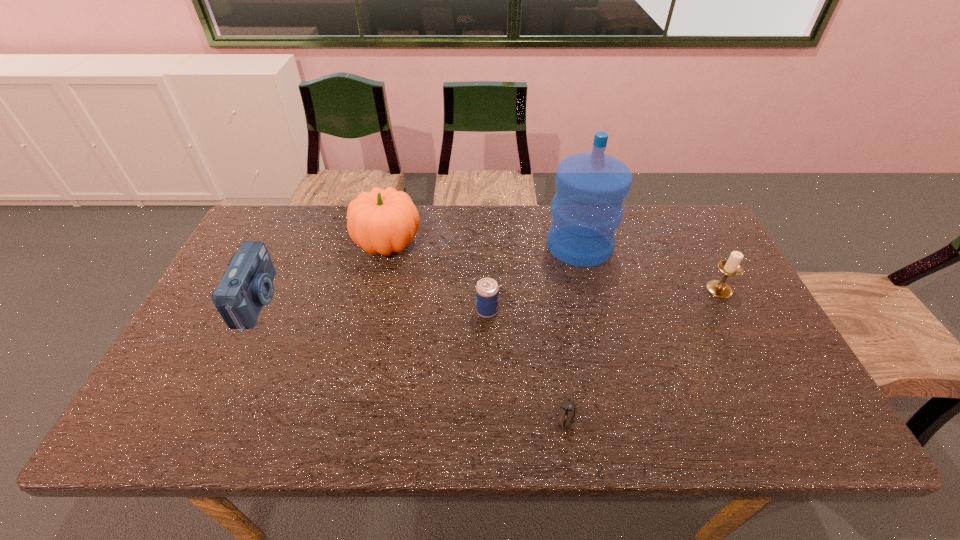
This screenshot has width=960, height=540. I want to click on free space at the far edge of the desktop, so click(x=654, y=231).

You are a GUI agent. You are given a task and a screenshot of the screen. Output one action in this format:
    pyautogui.click(x=<x>, y=<y>)
    Task: Click on the vacant space at the near edge of the desktop
    
    Given the screenshot: What is the action you would take?
    pyautogui.click(x=672, y=413)

In the image, there is a desktop. At what (x,y) coordinates should I click in order to perform the action: click on blank space at the left edge. Please return your answer as a coordinate pair (x, y). The height and width of the screenshot is (540, 960). Looking at the image, I should click on (191, 379).

The image size is (960, 540). I want to click on free space at the right edge of the desktop, so click(694, 259).

Find the location of a particular element. Image resolution: width=960 pixels, height=540 pixels. unoccupied position between the leftmost object and the shortest object is located at coordinates (412, 359).

Locate an element on the screen. The image size is (960, 540). vacant area between the candle holder and the beer can is located at coordinates (603, 300).

Image resolution: width=960 pixels, height=540 pixels. I want to click on free space between the camera and the pumpkin, so click(x=323, y=272).

Locate an element on the screen. The width and height of the screenshot is (960, 540). free space between the fifth shortest object and the leftmost object is located at coordinates (323, 272).

Locate an element on the screen. blank region between the second shortest object and the leftmost object is located at coordinates (372, 306).

Locate an element on the screen. free area in between the rightmost object and the pumpkin is located at coordinates (553, 267).